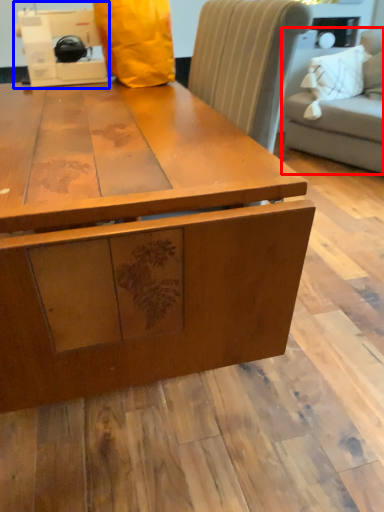
Question: Which point is further to the camera, studio couch (highlighted by a red box) or sewing machine (highlighted by a blue box)?

Choices:
 (A) studio couch
 (B) sewing machine

Answer: (A)